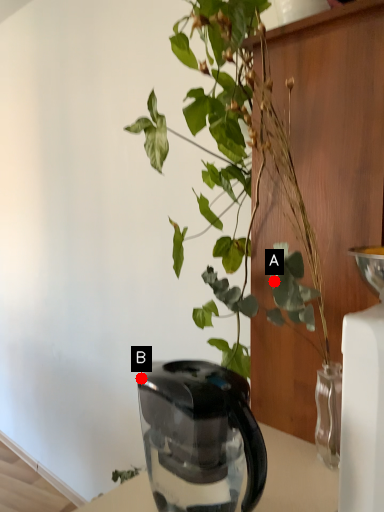
Question: Two points are circled on the image, labeled by A and B beside each circle. Among these points, which one is farthest from the camera?

Choices:
 (A) A is further
 (B) B is further

Answer: (B)